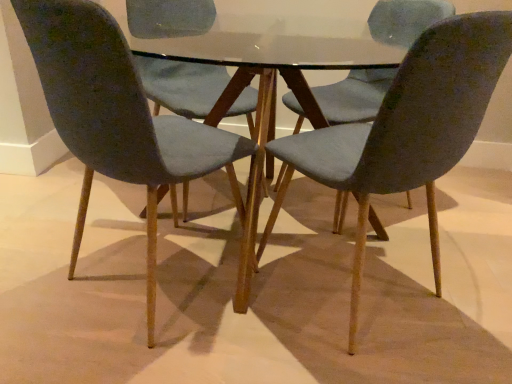
Question: Is velvet blue chair at center, which appears as the second chair when viewed from the left, oriented towards matte gray chair at left, which appears as the 3th chair when viewed from the right?

Choices:
 (A) yes
 (B) no

Answer: (B)

Question: From a real-world perspective, is velvet blue chair at center, which appears as the second chair when viewed from the left, positioned under matte gray chair at left, the first chair viewed from the left, based on gravity?

Choices:
 (A) yes
 (B) no

Answer: (B)

Question: Is matte gray chair at left, the first chair viewed from the left, at the back of velvet blue chair at center, which appears as the second chair when viewed from the left?

Choices:
 (A) no
 (B) yes

Answer: (A)

Question: Is velvet blue chair at center, which appears as the second chair when viewed from the left, smaller than matte gray chair at left, which appears as the 3th chair when viewed from the right?

Choices:
 (A) no
 (B) yes

Answer: (B)

Question: Could matte gray chair at left, the first chair viewed from the left, be considered to be inside velvet blue chair at center, the 2th chair from the right?

Choices:
 (A) yes
 (B) no

Answer: (B)

Question: Is velvet blue chair at center, which appears as the second chair when viewed from the left, at the right side of matte gray chair at left, which appears as the 3th chair when viewed from the right?

Choices:
 (A) no
 (B) yes

Answer: (B)

Question: Is glass table at center directly adjacent to velvet blue chair at center, the 2th chair from the right?

Choices:
 (A) no
 (B) yes

Answer: (A)

Question: Is glass table at center at the left side of velvet blue chair at center, the 2th chair from the right?

Choices:
 (A) no
 (B) yes

Answer: (A)

Question: Is velvet blue chair at center, which appears as the second chair when viewed from the left, surrounded by glass table at center?

Choices:
 (A) no
 (B) yes

Answer: (B)

Question: Is glass table at center looking in the opposite direction of velvet blue chair at center, the 2th chair from the right?

Choices:
 (A) no
 (B) yes

Answer: (B)

Question: Does glass table at center have a greater height compared to velvet blue chair at center, which appears as the second chair when viewed from the left?

Choices:
 (A) no
 (B) yes

Answer: (B)

Question: From a real-world perspective, is glass table at center below velvet blue chair at center, which appears as the second chair when viewed from the left?

Choices:
 (A) no
 (B) yes

Answer: (B)

Question: Is the position of matte blue chair at center, placed as the third chair when sorted from left to right, less distant than that of glass table at center?

Choices:
 (A) no
 (B) yes

Answer: (B)